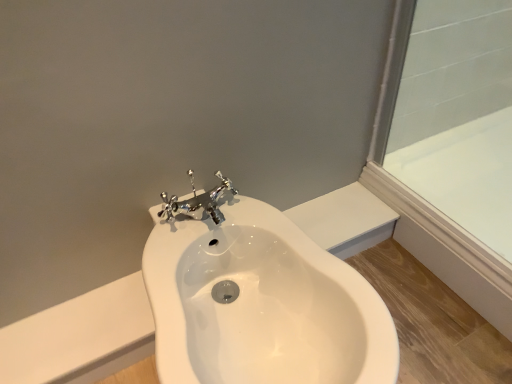
Question: Can you confirm if white glossy bathtub at upper right is positioned to the left of white glossy sink at center?

Choices:
 (A) yes
 (B) no

Answer: (B)

Question: Is white glossy bathtub at upper right to the right of white glossy sink at center from the viewer's perspective?

Choices:
 (A) yes
 (B) no

Answer: (A)

Question: Can we say white glossy bathtub at upper right lies outside white glossy sink at center?

Choices:
 (A) yes
 (B) no

Answer: (A)

Question: Does white glossy bathtub at upper right come behind white glossy sink at center?

Choices:
 (A) yes
 (B) no

Answer: (A)

Question: Can you confirm if white glossy bathtub at upper right is smaller than white glossy sink at center?

Choices:
 (A) yes
 (B) no

Answer: (A)

Question: Does white glossy bathtub at upper right come in front of white glossy sink at center?

Choices:
 (A) no
 (B) yes

Answer: (A)

Question: Is white glossy sink at center further to the viewer compared to white glossy bathtub at upper right?

Choices:
 (A) no
 (B) yes

Answer: (A)

Question: From a real-world perspective, does white glossy sink at center stand above white glossy bathtub at upper right?

Choices:
 (A) no
 (B) yes

Answer: (B)

Question: Is white glossy sink at center smaller than white glossy bathtub at upper right?

Choices:
 (A) no
 (B) yes

Answer: (A)

Question: Can you confirm if white glossy sink at center is taller than white glossy bathtub at upper right?

Choices:
 (A) no
 (B) yes

Answer: (B)

Question: Is white glossy sink at center directly adjacent to white glossy bathtub at upper right?

Choices:
 (A) yes
 (B) no

Answer: (B)

Question: Are white glossy sink at center and white glossy bathtub at upper right far apart?

Choices:
 (A) no
 (B) yes

Answer: (A)

Question: Is white glossy bathtub at upper right in front of or behind white glossy sink at center in the image?

Choices:
 (A) front
 (B) behind

Answer: (B)